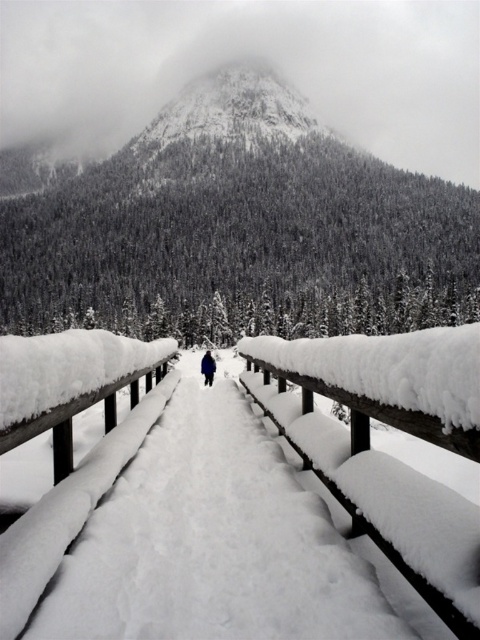
Is snowy textured mountain at upper center in front of wooden rail at center?

No, snowy textured mountain at upper center is behind wooden rail at center.

Between snowy textured mountain at upper center and wooden rail at center, which one has less height?

Standing shorter between the two is wooden rail at center.

Image resolution: width=480 pixels, height=640 pixels. Find the location of `snowy textured mountain at upper center`. snowy textured mountain at upper center is located at coordinates (240, 230).

Who is higher up, snowy textured mountain at upper center or dark blue fabric skier at center?

snowy textured mountain at upper center is above.

Between snowy textured mountain at upper center and dark blue fabric skier at center, which one has more height?

snowy textured mountain at upper center

Does point (285, 200) come closer to viewer compared to point (210, 364)?

No, it is behind (210, 364).

Find the location of a particular element. The width and height of the screenshot is (480, 640). snowy textured mountain at upper center is located at coordinates click(240, 230).

Can you confirm if wooden rail at center is shorter than dark blue fabric skier at center?

Answer: Correct, wooden rail at center is not as tall as dark blue fabric skier at center.

Can you confirm if wooden rail at center is positioned to the left of dark blue fabric skier at center?

Incorrect, wooden rail at center is not on the left side of dark blue fabric skier at center.

Find the location of a particular element. Image resolution: width=480 pixels, height=640 pixels. wooden rail at center is located at coordinates (383, 474).

Identify the location of wooden rail at center. (383, 474).